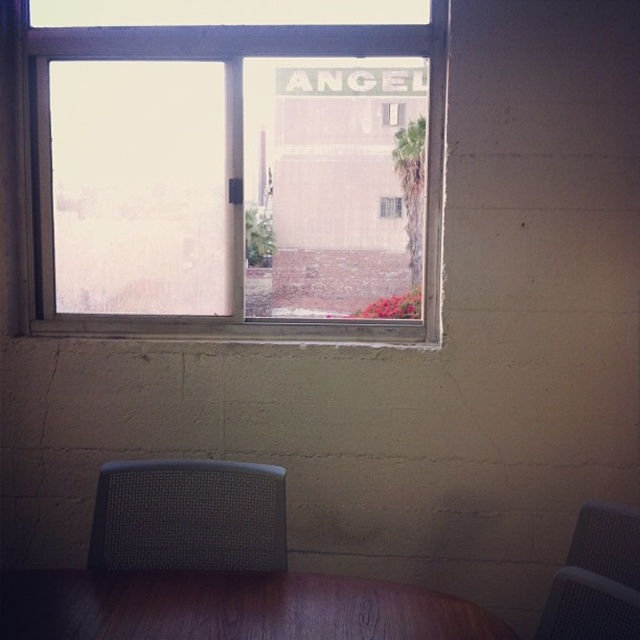
You are sitting on the gray mesh chair at lower left and want to reach the gray mesh chair at lower right. Which direction should you move to get closer to it?

You should move forward because the gray mesh chair at lower left is closer to you than the gray mesh chair at lower right, so moving toward it would bring you closer.

You are sitting at the wooden table at lower center and want to look outside. Which direction should you turn your head to see the clear glass window at upper center?

You should look upwards to see the clear glass window at upper center since it is positioned above the wooden table at lower center.

You are sitting on the gray mesh chair at lower left and want to move to the gray mesh chair at lower right. Considering their heights, which chair will require you to step down from?

The gray mesh chair at lower right is shorter than the gray mesh chair at lower left, so you will need to step down from the gray mesh chair at lower left to reach the gray mesh chair at lower right.